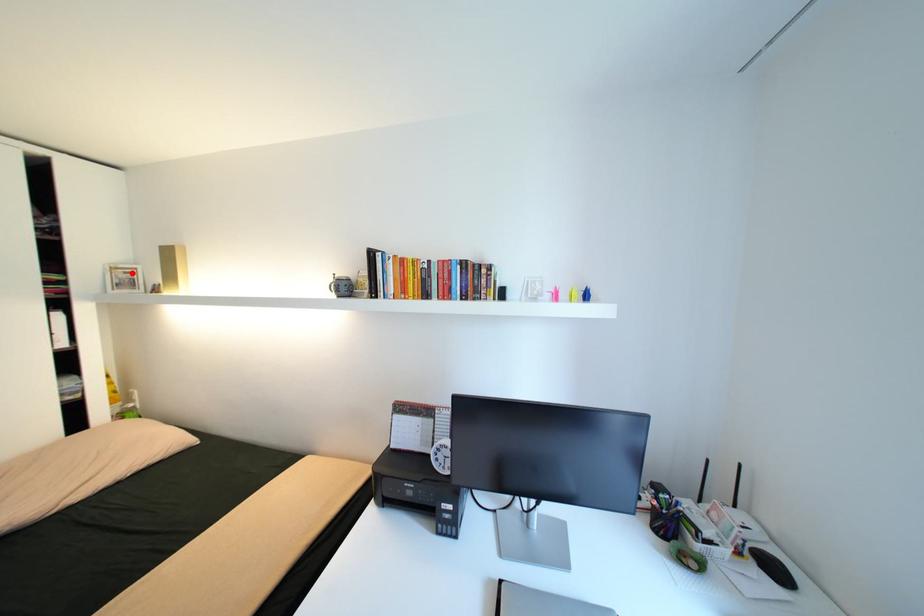
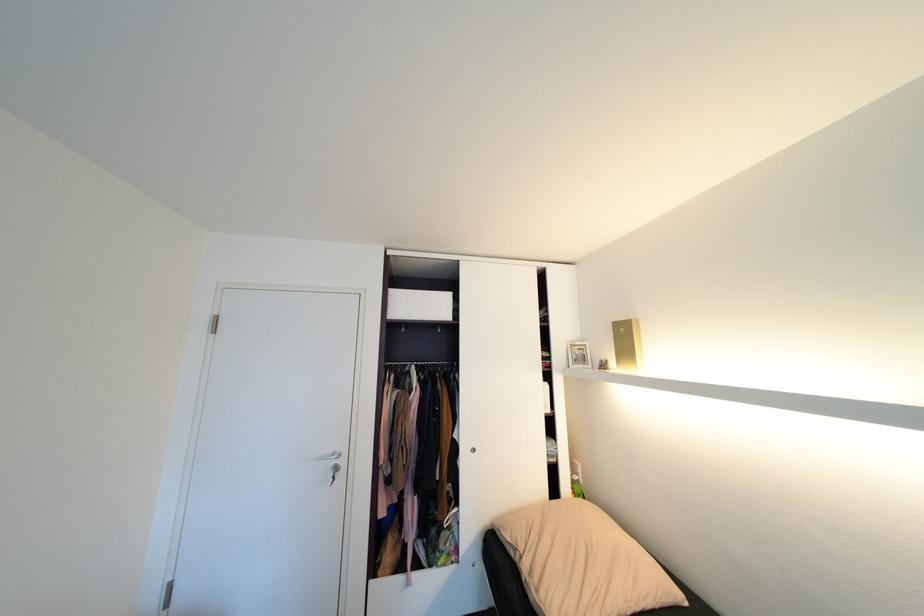
The point at the highlighted location is marked in the first image. Where is the corresponding point in the second image?

(587, 350)